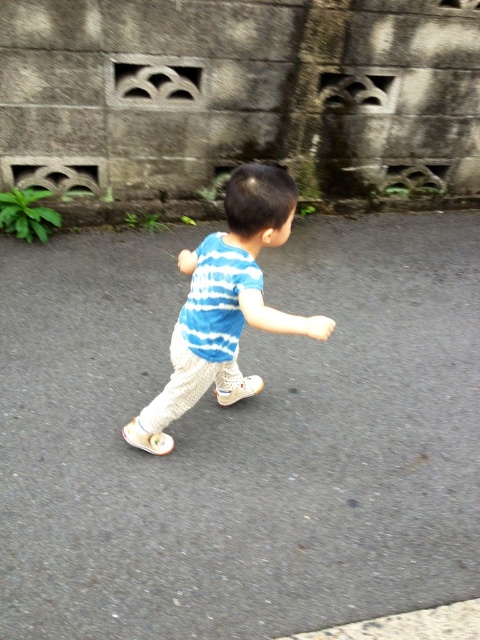
Which is above, gray asphalt pavement at center or blue striped shirt at center?

blue striped shirt at center is above.

Which of these two, gray asphalt pavement at center or blue striped shirt at center, stands taller?

gray asphalt pavement at center is taller.

The width and height of the screenshot is (480, 640). Describe the element at coordinates (240, 436) in the screenshot. I see `gray asphalt pavement at center` at that location.

Locate an element on the screen. This screenshot has height=640, width=480. gray asphalt pavement at center is located at coordinates (240, 436).